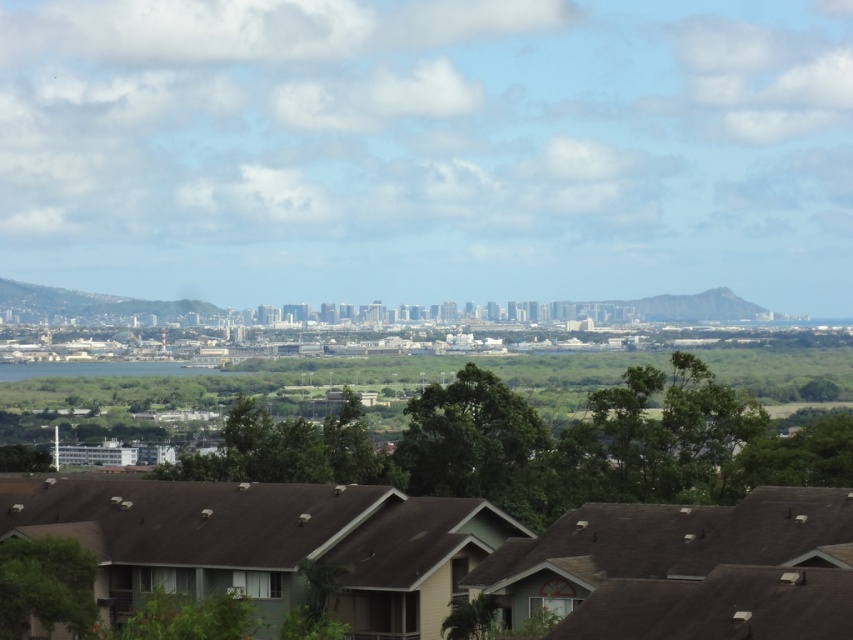
Is green leafy tree at center smaller than green leafy tree at lower left?

Incorrect, green leafy tree at center is not smaller in size than green leafy tree at lower left.

Does green leafy tree at center appear on the right side of green leafy tree at lower left?

Yes, green leafy tree at center is to the right of green leafy tree at lower left.

Between point (469, 422) and point (28, 625), which one is positioned behind?

The point (469, 422) is behind.

I want to click on green leafy tree at center, so click(469, 438).